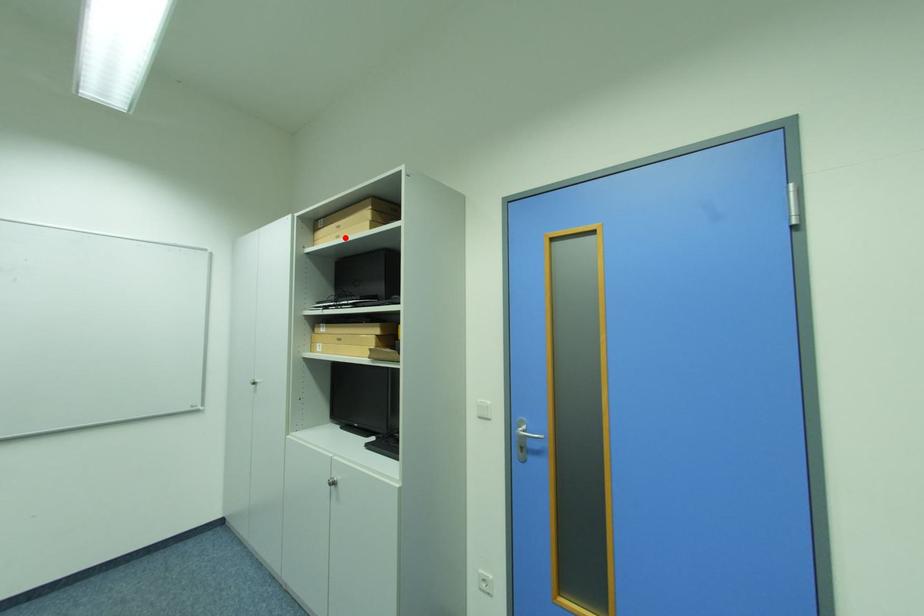
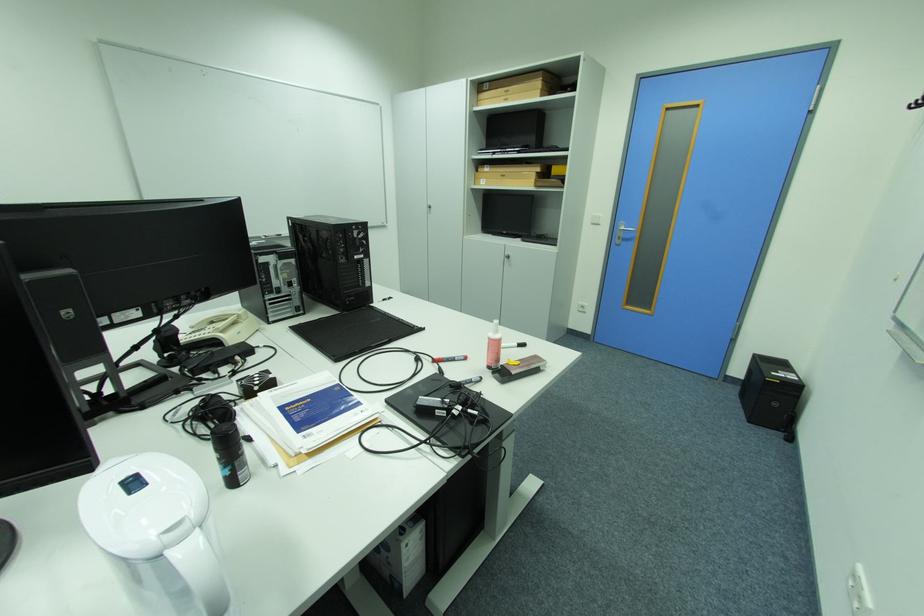
The point at the highlighted location is marked in the first image. Where is the corresponding point in the second image?

(514, 100)